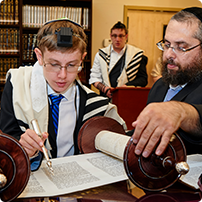
What are the coordinates of `wooden scroll holder` in the screenshot? It's located at 147,170, 86,133, 15,165.